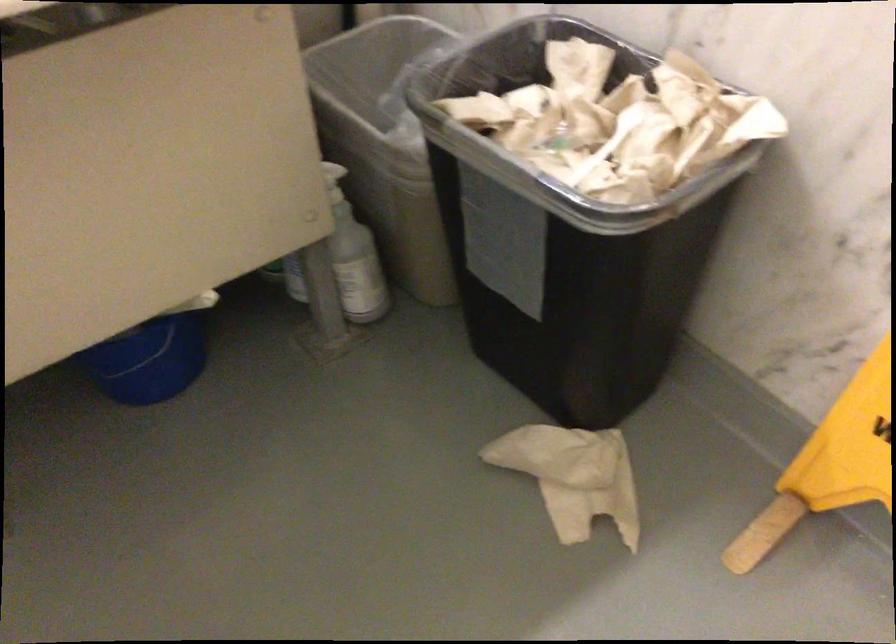
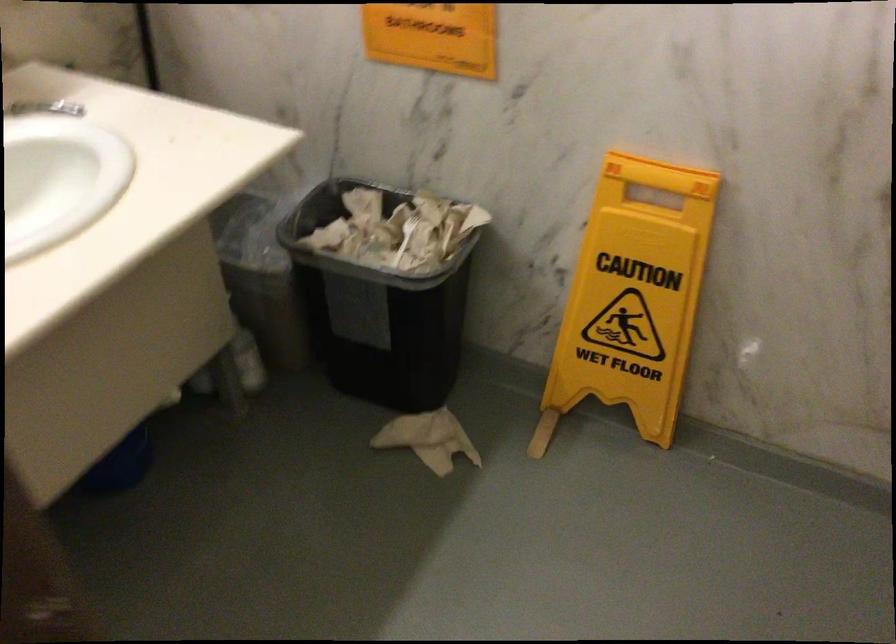
Find the pixel in the second image that matches pixel 569 469 in the first image.

(428, 439)